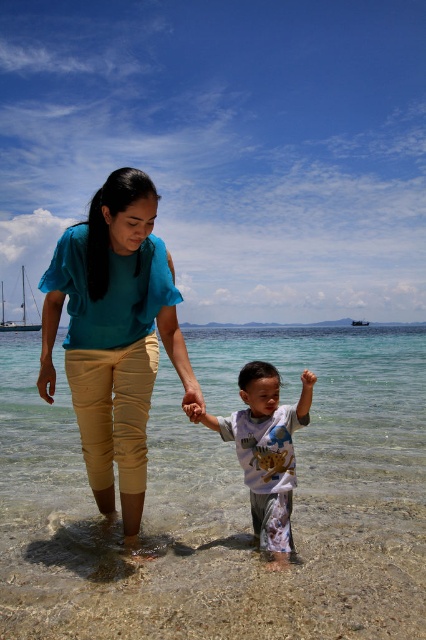
Question: Is teal fabric shirt at center wider than white cotton shirt at center?

Choices:
 (A) yes
 (B) no

Answer: (A)

Question: Which point is farther to the camera?

Choices:
 (A) (155, 477)
 (B) (103, 484)

Answer: (A)

Question: Is teal fabric shirt at center behind white cotton shirt at center?

Choices:
 (A) no
 (B) yes

Answer: (A)

Question: Which point appears farthest from the camera in this image?

Choices:
 (A) (273, 432)
 (B) (120, 212)

Answer: (A)

Question: Among these points, which one is farthest from the camera?

Choices:
 (A) (201, 403)
 (B) (414, 330)

Answer: (B)

Question: Does clear water at child right appear on the right side of white cotton shirt at center?

Choices:
 (A) yes
 (B) no

Answer: (A)